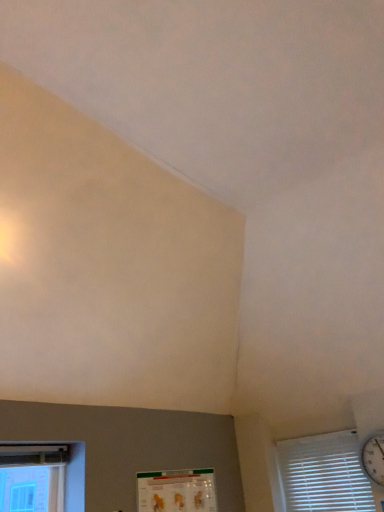
Where is `white plastic clock at right`? white plastic clock at right is located at coordinates (374, 458).

Describe the element at coordinates (374, 458) in the screenshot. The height and width of the screenshot is (512, 384). I see `white plastic clock at right` at that location.

At what (x,y) coordinates should I click in order to perform the action: click on white plastic clock at right. Please return your answer as a coordinate pair (x, y). Looking at the image, I should click on (374, 458).